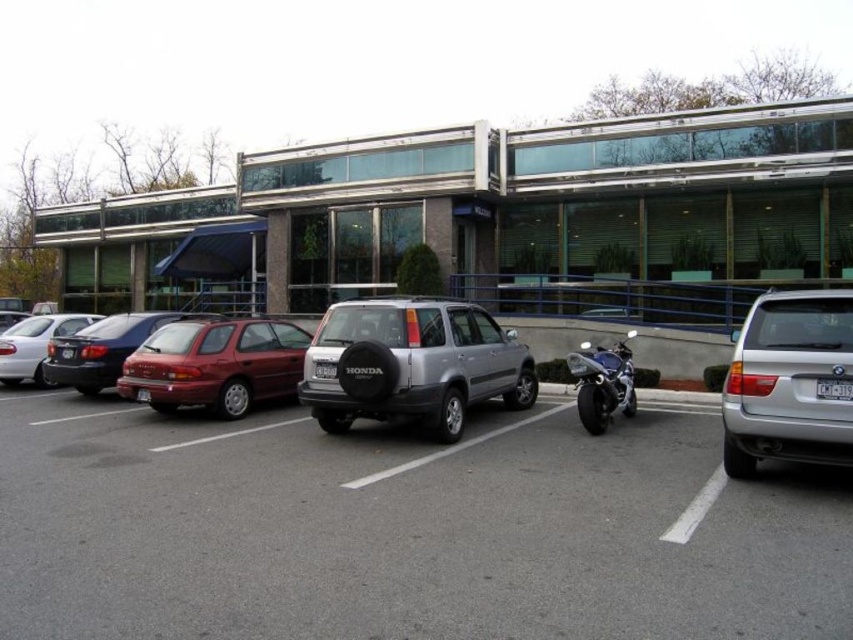
You are standing at the point with coordinates point (x=51, y=348) and want to walk to the entrance of the building. There is an obstacle at point (x=625, y=358) blocking your path. Can you walk around the obstacle to reach the entrance?

Since point (x=51, y=348) is behind point (x=625, y=358), you can walk around the obstacle by moving to the left or right side of the obstacle to reach the entrance.